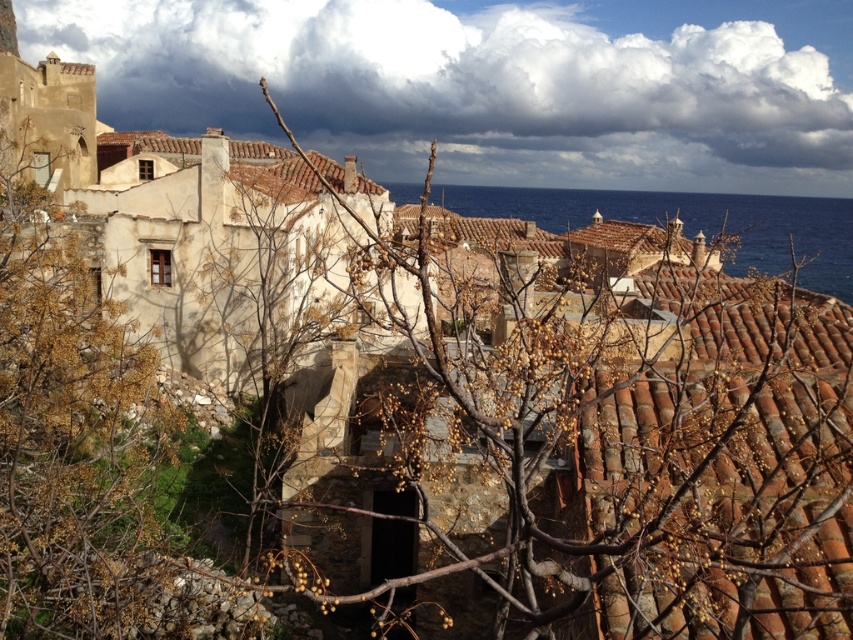
Can you confirm if blue water at center is shorter than brown tile roof at center?

No, blue water at center is not shorter than brown tile roof at center.

Can you confirm if blue water at center is thinner than brown tile roof at center?

In fact, blue water at center might be wider than brown tile roof at center.

I want to click on blue water at center, so click(x=692, y=221).

Who is taller, blue water at center or brown tile roof at upper left?

blue water at center is taller.

Where is `blue water at center`? blue water at center is located at coordinates (692, 221).

The image size is (853, 640). In order to click on blue water at center in this screenshot , I will do `click(692, 221)`.

Can you confirm if brown tile roof at center is positioned above brown tile roof at upper left?

No.

Which is more to the left, brown tile roof at center or brown tile roof at upper left?

From the viewer's perspective, brown tile roof at upper left appears more on the left side.

This screenshot has width=853, height=640. What do you see at coordinates (578, 241) in the screenshot? I see `brown tile roof at center` at bounding box center [578, 241].

In order to click on brown tile roof at center in this screenshot , I will do `click(578, 241)`.